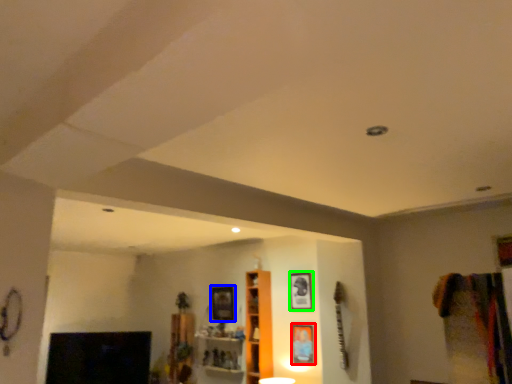
Question: Based on their relative distances, which object is farther from picture frame (highlighted by a red box)? Choose from picture frame (highlighted by a blue box) and picture frame (highlighted by a green box).

Choices:
 (A) picture frame
 (B) picture frame

Answer: (A)